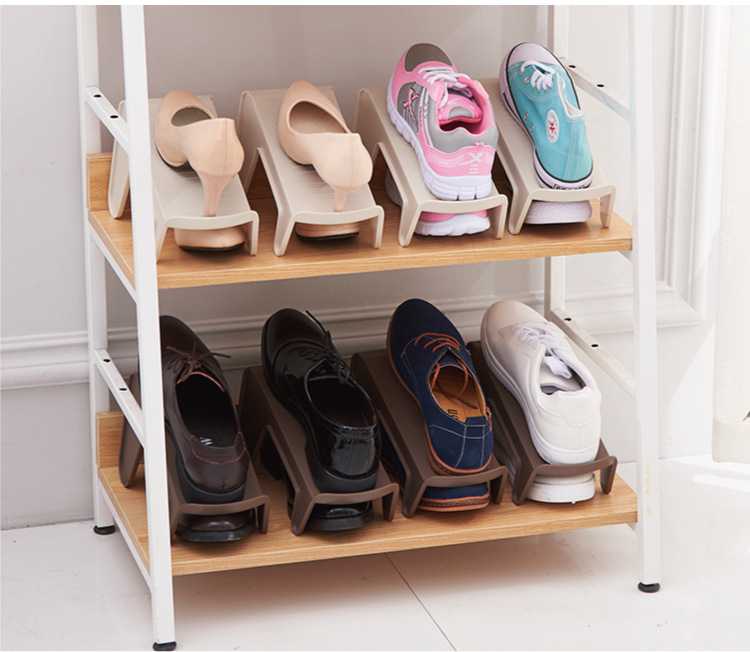
The height and width of the screenshot is (652, 750). Identify the location of plastic shoe holder. (237, 499), (350, 496), (441, 481), (561, 464), (546, 188), (428, 207), (316, 218), (207, 226).